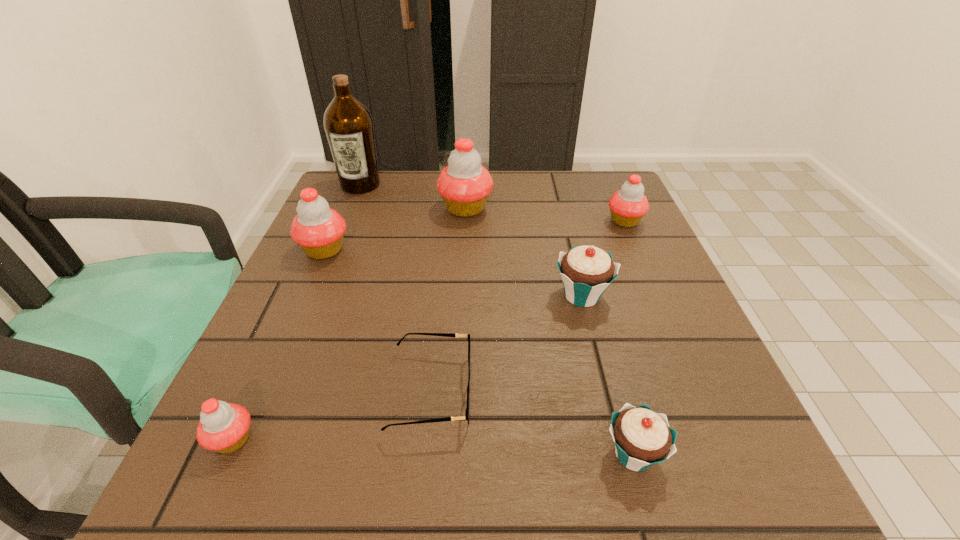
Find the location of a particular element. This screenshot has width=960, height=540. brown olive oil is located at coordinates (349, 127).

Identify the location of olive oil. (349, 127).

Find the location of a particular element. The image size is (960, 540). the biggest red cupcake is located at coordinates (464, 185).

Where is `the second red cupcake from right to left`? The width and height of the screenshot is (960, 540). the second red cupcake from right to left is located at coordinates (464, 185).

The width and height of the screenshot is (960, 540). I want to click on the second biggest red cupcake, so click(319, 230).

Image resolution: width=960 pixels, height=540 pixels. Find the location of `the fifth shortest cupcake`. the fifth shortest cupcake is located at coordinates (319, 230).

Where is `the rightmost object`? The height and width of the screenshot is (540, 960). the rightmost object is located at coordinates (627, 206).

Locate an element on the screen. the rightmost red cupcake is located at coordinates tap(627, 206).

The width and height of the screenshot is (960, 540). In order to click on the third nearest cupcake in this screenshot , I will do `click(586, 271)`.

This screenshot has height=540, width=960. In order to click on the farther teal cupcake in this screenshot , I will do `click(586, 271)`.